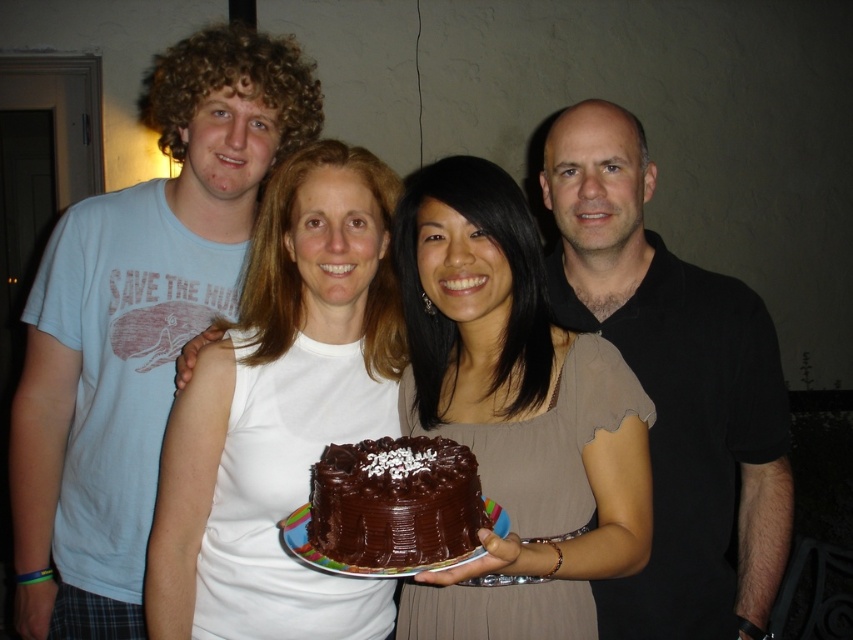
Between point (556, 342) and point (722, 285), which one is positioned in front?

Point (556, 342)

Describe the element at coordinates (515, 410) in the screenshot. The width and height of the screenshot is (853, 640). I see `smooth chocolate cake at center` at that location.

You are a GUI agent. You are given a task and a screenshot of the screen. Output one action in this format:
    pyautogui.click(x=<x>, y=<y>)
    Task: Click on the smooth chocolate cake at center
    
    Given the screenshot: What is the action you would take?
    pyautogui.click(x=515, y=410)

Is point (318, 348) closer to viewer compared to point (567, 157)?

Yes, it is.

Which of these two, white matte shirt at center or black matte shirt at right, stands taller?

With more height is black matte shirt at right.

The image size is (853, 640). What do you see at coordinates (282, 412) in the screenshot?
I see `white matte shirt at center` at bounding box center [282, 412].

Identify the location of white matte shirt at center. Image resolution: width=853 pixels, height=640 pixels. (282, 412).

Does black matte shirt at right have a lesser height compared to chocolatesmoothcake at center?

No.

Image resolution: width=853 pixels, height=640 pixels. What do you see at coordinates (674, 388) in the screenshot? I see `black matte shirt at right` at bounding box center [674, 388].

Between point (556, 166) and point (404, 502), which one is positioned behind?

Point (556, 166)

At what (x,y) coordinates should I click in order to perform the action: click on black matte shirt at right. Please return your answer as a coordinate pair (x, y). Looking at the image, I should click on (674, 388).